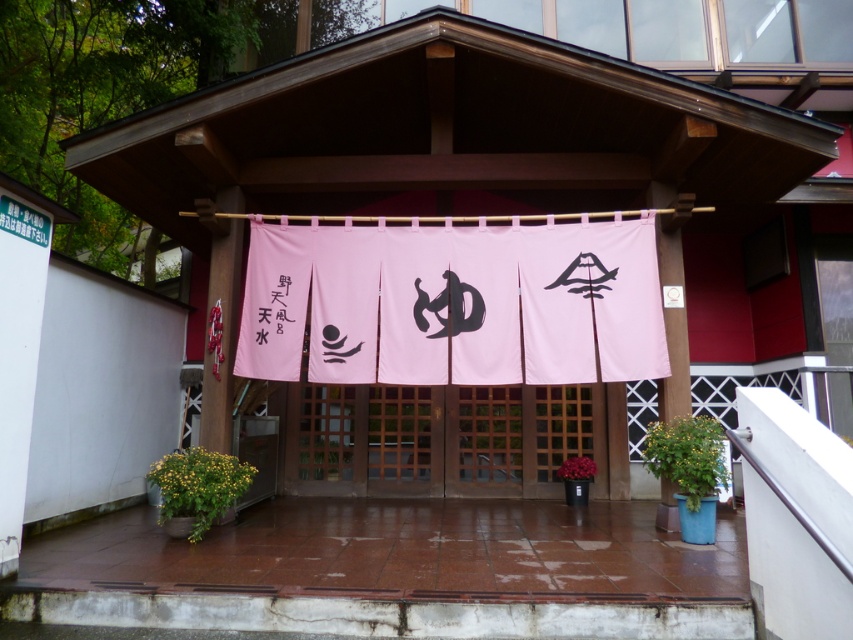
Question: Which of the following is the closest to the observer?

Choices:
 (A) pink fabric banner at center
 (B) black paper at left

Answer: (A)

Question: Can you confirm if pink fabric banner at center is thinner than black paper at left?

Choices:
 (A) no
 (B) yes

Answer: (A)

Question: Can you confirm if pink fabric banner at center is positioned to the left of black paper at left?

Choices:
 (A) yes
 (B) no

Answer: (B)

Question: Is pink fabric banner at center positioned in front of black paper at left?

Choices:
 (A) no
 (B) yes

Answer: (B)

Question: Among these points, which one is nearest to the camera?

Choices:
 (A) (277, 362)
 (B) (277, 298)

Answer: (A)

Question: Among these objects, which one is farthest from the camera?

Choices:
 (A) pink fabric banner at center
 (B) black paper at left

Answer: (B)